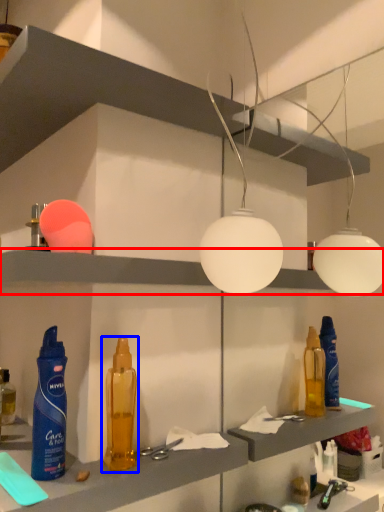
Question: Which object appears farthest to the camera in this image, shelf (highlighted by a red box) or bottle (highlighted by a blue box)?

Choices:
 (A) shelf
 (B) bottle

Answer: (B)